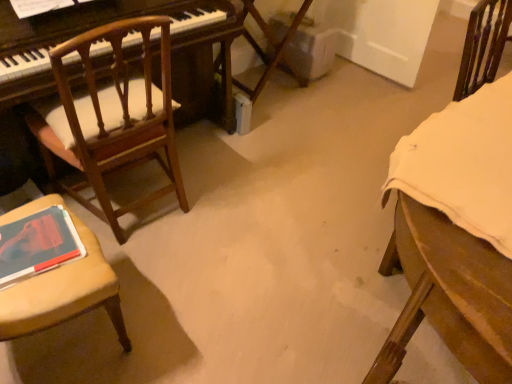
Image resolution: width=512 pixels, height=384 pixels. Describe the element at coordinates (61, 286) in the screenshot. I see `wooden chair with cushion at left, which is the 1th chair in left-to-right order` at that location.

Find the location of a particular element. wooden chair with cushion at left, which is the 1th chair in left-to-right order is located at coordinates (61, 286).

The height and width of the screenshot is (384, 512). What do you see at coordinates (112, 119) in the screenshot?
I see `wooden chair with cushion at left, marked as the 2th chair in a left-to-right arrangement` at bounding box center [112, 119].

Locate an element on the screen. wooden chair at right, marked as the first chair in a right-to-left arrangement is located at coordinates (448, 294).

Considering the sizes of objects matte red book at lower left and wooden chair with cushion at left, which is the 1th chair in left-to-right order, in the image provided, who is smaller, matte red book at lower left or wooden chair with cushion at left, which is the 1th chair in left-to-right order,?

Smaller between the two is matte red book at lower left.

Does matte red book at lower left lie in front of wooden chair with cushion at left, which is the 1th chair in left-to-right order?

No, it is behind wooden chair with cushion at left, which is the 1th chair in left-to-right order.

From a real-world perspective, is matte red book at lower left under wooden chair with cushion at left, the 3th chair in the right-to-left sequence?

No.

From a real-world perspective, which chair is the 2nd one underneath the wooden chair with cushion at left, arranged as the 2th chair when viewed from the right? Please provide its 2D coordinates.

[(448, 294)]

In the image, is wooden chair with cushion at left, marked as the 2th chair in a left-to-right arrangement, on the left side or the right side of wooden chair at right, marked as the first chair in a right-to-left arrangement?

Based on their positions, wooden chair with cushion at left, marked as the 2th chair in a left-to-right arrangement, is located to the left of wooden chair at right, marked as the first chair in a right-to-left arrangement.

Does point (168, 95) come in front of point (477, 70)?

Yes, it is in front of point (477, 70).

Considering the sizes of objects wooden chair with cushion at left, marked as the 2th chair in a left-to-right arrangement, and wooden chair at right, which appears as the third chair when viewed from the left, in the image provided, who is wider, wooden chair with cushion at left, marked as the 2th chair in a left-to-right arrangement, or wooden chair at right, which appears as the third chair when viewed from the left,?

wooden chair at right, which appears as the third chair when viewed from the left, is wider.

Considering the sizes of objects wooden chair at right, marked as the first chair in a right-to-left arrangement, and wooden chair with cushion at left, the 3th chair in the right-to-left sequence, in the image provided, who is smaller, wooden chair at right, marked as the first chair in a right-to-left arrangement, or wooden chair with cushion at left, the 3th chair in the right-to-left sequence,?

wooden chair with cushion at left, the 3th chair in the right-to-left sequence, is smaller.

Is wooden chair at right, which appears as the third chair when viewed from the left, looking in the opposite direction of wooden chair with cushion at left, the 3th chair in the right-to-left sequence?

No, wooden chair at right, which appears as the third chair when viewed from the left, is not facing the opposite direction of wooden chair with cushion at left, the 3th chair in the right-to-left sequence.

From the image's perspective, is wooden chair at right, which appears as the third chair when viewed from the left, below wooden chair with cushion at left, which is the 1th chair in left-to-right order?

→ Actually, wooden chair at right, which appears as the third chair when viewed from the left, appears above wooden chair with cushion at left, which is the 1th chair in left-to-right order, in the image.

Is point (428, 301) positioned behind point (56, 321)?

No, it is in front of (56, 321).

Considering the points (65, 140) and (34, 250), which point is behind, point (65, 140) or point (34, 250)?

The point (65, 140) is behind.

Is wooden chair with cushion at left, marked as the 2th chair in a left-to-right arrangement, in contact with matte red book at lower left?

wooden chair with cushion at left, marked as the 2th chair in a left-to-right arrangement, is not next to matte red book at lower left, and they're not touching.

Would you say wooden chair with cushion at left, arranged as the 2th chair when viewed from the right, is inside or outside matte red book at lower left?

wooden chair with cushion at left, arranged as the 2th chair when viewed from the right, is not enclosed by matte red book at lower left.

Who is taller, wooden chair with cushion at left, marked as the 2th chair in a left-to-right arrangement, or matte red book at lower left?

wooden chair with cushion at left, marked as the 2th chair in a left-to-right arrangement.

Considering the relative sizes of matte red book at lower left and wooden chair with cushion at left, marked as the 2th chair in a left-to-right arrangement, in the image provided, is matte red book at lower left smaller than wooden chair with cushion at left, marked as the 2th chair in a left-to-right arrangement,?

Yes, matte red book at lower left is smaller than wooden chair with cushion at left, marked as the 2th chair in a left-to-right arrangement.

Would you say matte red book at lower left is to the left or to the right of wooden chair with cushion at left, arranged as the 2th chair when viewed from the right, in the picture?

Clearly, matte red book at lower left is on the left of wooden chair with cushion at left, arranged as the 2th chair when viewed from the right, in the image.

Which object is thinner, matte red book at lower left or wooden chair with cushion at left, arranged as the 2th chair when viewed from the right?

Thinner between the two is matte red book at lower left.

From a real-world perspective, relative to wooden chair with cushion at left, arranged as the 2th chair when viewed from the right, is matte red book at lower left vertically above or below?

In terms of real-world spatial position, matte red book at lower left is above wooden chair with cushion at left, arranged as the 2th chair when viewed from the right.

Considering the positions of point (79, 261) and point (429, 302), is point (79, 261) closer or farther from the camera than point (429, 302)?

Point (79, 261) appears to be farther away from the viewer than point (429, 302).

Which of these two, wooden chair with cushion at left, which is the 1th chair in left-to-right order, or wooden chair at right, which appears as the third chair when viewed from the left, stands shorter?

wooden chair at right, which appears as the third chair when viewed from the left, is shorter.

You are a GUI agent. You are given a task and a screenshot of the screen. Output one action in this format:
    pyautogui.click(x=<x>, y=<y>)
    Task: Click on the 2nd chair to the right when counting from the wooden chair with cushion at left, the 3th chair in the right-to-left sequence
    Image resolution: width=512 pixels, height=384 pixels.
    Given the screenshot: What is the action you would take?
    pyautogui.click(x=448, y=294)

Considering the sizes of wooden chair with cushion at left, which is the 1th chair in left-to-right order, and wooden chair at right, which appears as the third chair when viewed from the left, in the image, is wooden chair with cushion at left, which is the 1th chair in left-to-right order, wider or thinner than wooden chair at right, which appears as the third chair when viewed from the left,?

Considering their sizes, wooden chair with cushion at left, which is the 1th chair in left-to-right order, looks slimmer than wooden chair at right, which appears as the third chair when viewed from the left.

From the image's perspective, which one is positioned higher, wooden chair with cushion at left, which is the 1th chair in left-to-right order, or wooden chair with cushion at left, marked as the 2th chair in a left-to-right arrangement?

wooden chair with cushion at left, marked as the 2th chair in a left-to-right arrangement.

Between wooden chair with cushion at left, which is the 1th chair in left-to-right order, and wooden chair with cushion at left, arranged as the 2th chair when viewed from the right, which one has larger size?

Bigger between the two is wooden chair with cushion at left, arranged as the 2th chair when viewed from the right.

Locate an element on the screen. the 2nd chair above the wooden chair with cushion at left, the 3th chair in the right-to-left sequence (from the image's perspective) is located at coordinates (112, 119).

Considering the sizes of objects wooden chair with cushion at left, which is the 1th chair in left-to-right order, and wooden chair with cushion at left, marked as the 2th chair in a left-to-right arrangement, in the image provided, who is taller, wooden chair with cushion at left, which is the 1th chair in left-to-right order, or wooden chair with cushion at left, marked as the 2th chair in a left-to-right arrangement,?

wooden chair with cushion at left, marked as the 2th chair in a left-to-right arrangement, is taller.

From a real-world perspective, which chair is the 2nd one underneath the matte red book at lower left? Please provide its 2D coordinates.

[(61, 286)]

Image resolution: width=512 pixels, height=384 pixels. Find the location of `the 1st chair in front of the wooden chair with cushion at left, marked as the 2th chair in a left-to-right arrangement`. the 1st chair in front of the wooden chair with cushion at left, marked as the 2th chair in a left-to-right arrangement is located at coordinates (448, 294).

Considering their positions, is wooden chair with cushion at left, marked as the 2th chair in a left-to-right arrangement, positioned further to wooden chair with cushion at left, which is the 1th chair in left-to-right order, than matte red book at lower left?

wooden chair with cushion at left, marked as the 2th chair in a left-to-right arrangement, lies further to wooden chair with cushion at left, which is the 1th chair in left-to-right order, than the other object.

Estimate the real-world distances between objects in this image. Which object is further from wooden chair with cushion at left, arranged as the 2th chair when viewed from the right, wooden chair at right, marked as the first chair in a right-to-left arrangement, or matte red book at lower left?

Based on the image, wooden chair at right, marked as the first chair in a right-to-left arrangement, appears to be further to wooden chair with cushion at left, arranged as the 2th chair when viewed from the right.

From the image, which object appears to be farther from wooden chair with cushion at left, marked as the 2th chair in a left-to-right arrangement, matte red book at lower left or wooden chair with cushion at left, the 3th chair in the right-to-left sequence?

matte red book at lower left is positioned further to the anchor wooden chair with cushion at left, marked as the 2th chair in a left-to-right arrangement.

Consider the image. From the image, which object appears to be farther from wooden chair at right, marked as the first chair in a right-to-left arrangement, wooden chair with cushion at left, which is the 1th chair in left-to-right order, or wooden chair with cushion at left, marked as the 2th chair in a left-to-right arrangement?

wooden chair with cushion at left, marked as the 2th chair in a left-to-right arrangement.

Looking at the image, which one is located closer to wooden chair at right, which appears as the third chair when viewed from the left, wooden chair with cushion at left, which is the 1th chair in left-to-right order, or matte red book at lower left?

wooden chair with cushion at left, which is the 1th chair in left-to-right order, is closer to wooden chair at right, which appears as the third chair when viewed from the left.

Based on their spatial positions, is wooden chair at right, which appears as the third chair when viewed from the left, or wooden chair with cushion at left, which is the 1th chair in left-to-right order, closer to matte red book at lower left?

wooden chair with cushion at left, which is the 1th chair in left-to-right order.

From the image, which object appears to be nearer to wooden chair with cushion at left, the 3th chair in the right-to-left sequence, wooden chair with cushion at left, arranged as the 2th chair when viewed from the right, or wooden chair at right, which appears as the third chair when viewed from the left?

wooden chair with cushion at left, arranged as the 2th chair when viewed from the right, lies closer to wooden chair with cushion at left, the 3th chair in the right-to-left sequence, than the other object.

Based on their spatial positions, is matte red book at lower left or wooden chair with cushion at left, arranged as the 2th chair when viewed from the right, closer to wooden chair with cushion at left, the 3th chair in the right-to-left sequence?

matte red book at lower left.

Locate an element on the screen. book between wooden chair with cushion at left, marked as the 2th chair in a left-to-right arrangement, and wooden chair with cushion at left, the 3th chair in the right-to-left sequence, in the vertical direction is located at coordinates (37, 245).

The height and width of the screenshot is (384, 512). In order to click on chair located between wooden chair with cushion at left, the 3th chair in the right-to-left sequence, and wooden chair at right, marked as the first chair in a right-to-left arrangement, in the left-right direction in this screenshot , I will do tap(112, 119).